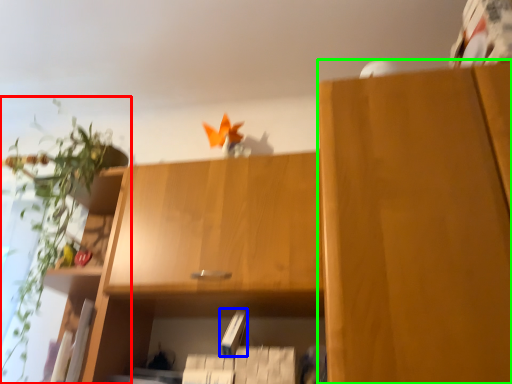
Question: Which object is positioned closest to houseplant (highlighted by a red box)? Select from paperback book (highlighted by a blue box) and cabinetry (highlighted by a green box).

Choices:
 (A) paperback book
 (B) cabinetry

Answer: (A)